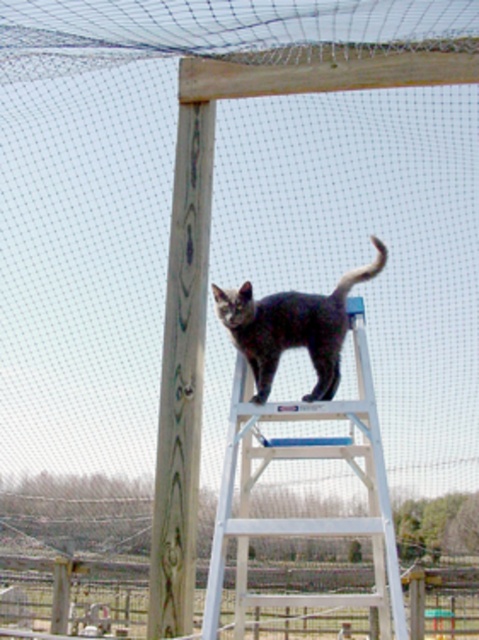
Question: Which is nearer to the wooden pole at center?

Choices:
 (A) white plastic ladder at center
 (B) gray fur cat at center

Answer: (B)

Question: Can you confirm if white plastic ladder at center is bigger than gray fur cat at center?

Choices:
 (A) no
 (B) yes

Answer: (B)

Question: Which object is the closest to the wooden pole at center?

Choices:
 (A) white plastic ladder at center
 (B) gray fur cat at center

Answer: (B)

Question: Does white plastic ladder at center have a lesser width compared to wooden pole at center?

Choices:
 (A) no
 (B) yes

Answer: (A)

Question: Does white plastic ladder at center appear on the left side of gray fur cat at center?

Choices:
 (A) yes
 (B) no

Answer: (B)

Question: Which point is farther to the camera?

Choices:
 (A) gray fur cat at center
 (B) wooden pole at center
 (C) white plastic ladder at center

Answer: (B)